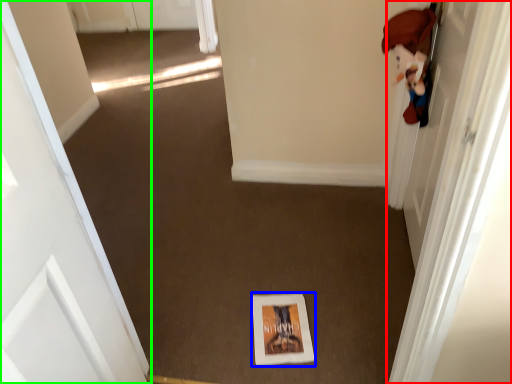
Question: Considering the real-world distances, which object is farthest from door (highlighted by a red box)? print (highlighted by a blue box) or door (highlighted by a green box)?

Choices:
 (A) print
 (B) door

Answer: (B)